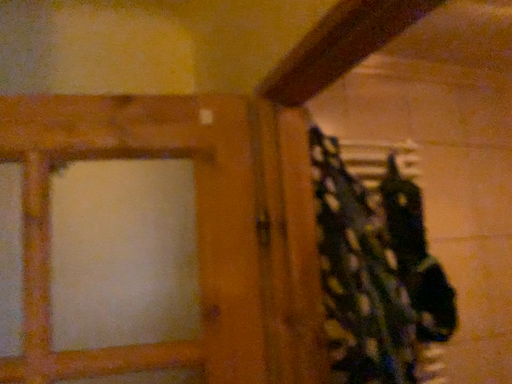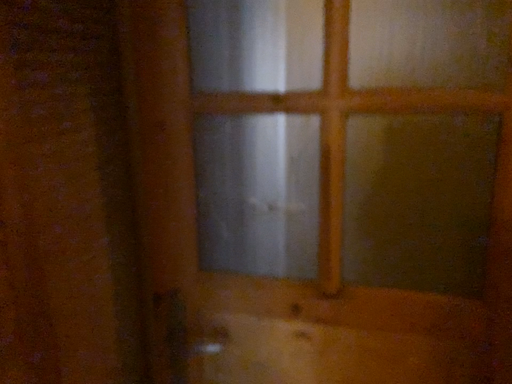
Question: Which way did the camera rotate in the video?

Choices:
 (A) rotated right
 (B) rotated left

Answer: (B)